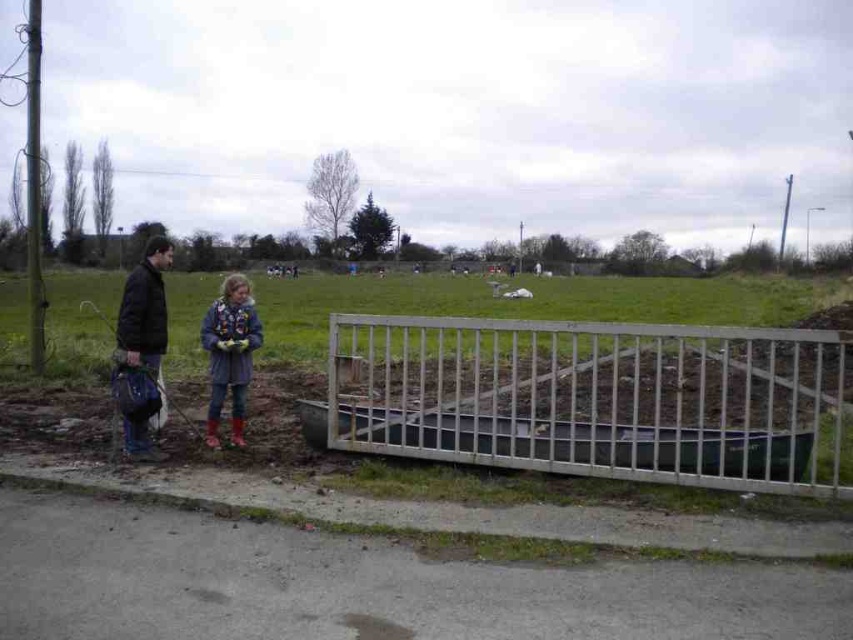
You are a delivery person trying to reach the denim jacket at center. The silver metallic fence at center is blocking your path. Can you walk around the fence to reach the jacket?

The silver metallic fence at center is in front of the denim jacket at center, so you can walk around the fence to reach the denim jacket at center.

You are a tailor measuring jackets for alterations. You have a tailor mannequin that can only fit jackets narrower than 40 cm. You need to determine if both the dark brown leather jacket at left and the denim jacket at center can fit on the mannequin. Which jacket will fit?

The dark brown leather jacket at left has a lesser width compared to denim jacket at center. Since the denim jacket at center is wider, the dark brown leather jacket at left will fit on the tailor mannequin if its width is under 40 cm, but the denim jacket at center may not fit due to its greater width.